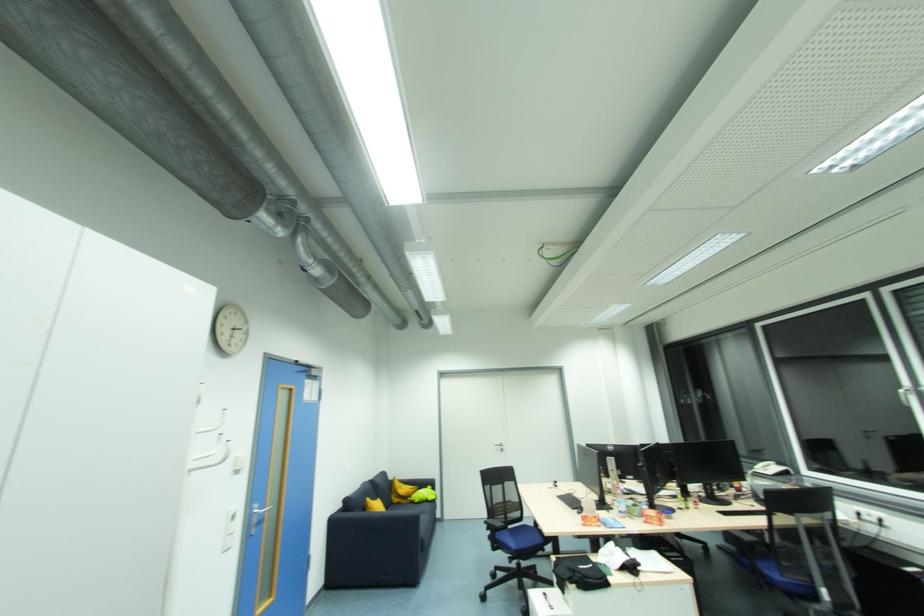
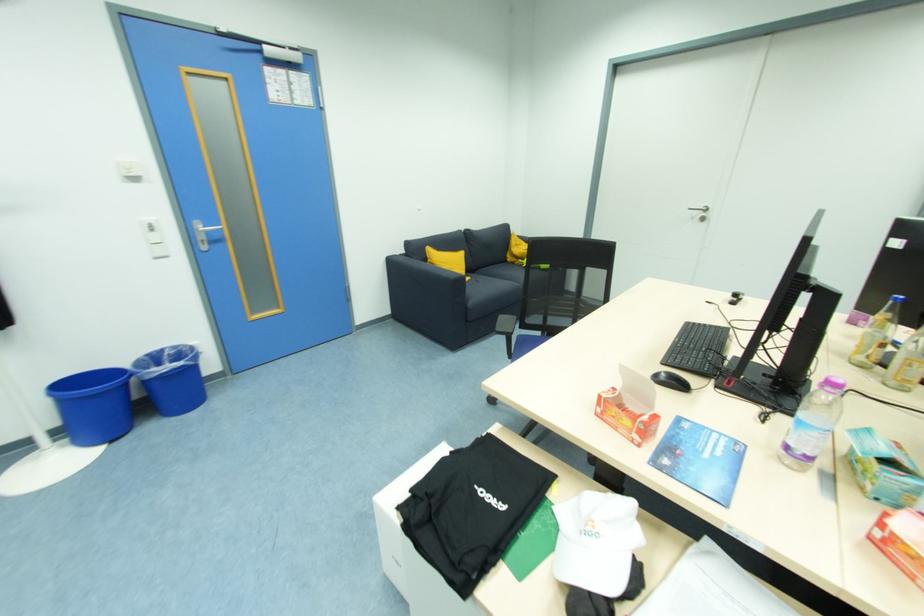
Locate, in the second image, the point that corresponds to (x=624, y=514) in the first image.

(792, 448)